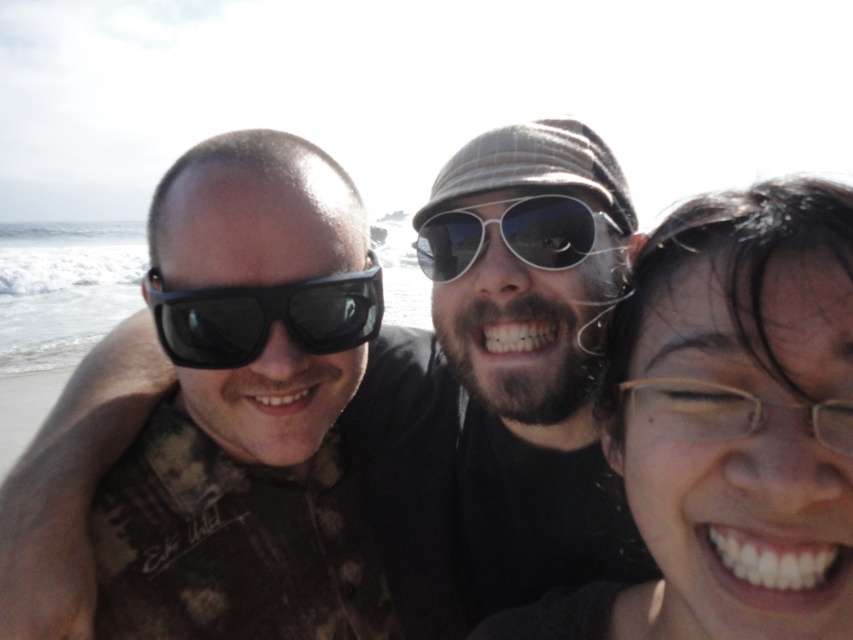
You are a photographer trying to capture a closeup shot of the clear plastic glasses at center and the metal aviator sunglasses at center. Which of these two items has a smaller width?

The clear plastic glasses at center has a lesser width compared to the metal aviator sunglasses at center, so the clear plastic glasses at center is the smaller one in width.

You are standing in front of the three people in the beach photo. You want to throw a ball to the closest point between the two points marked as point 1 at (x=372, y=330) and point 2 at (x=540, y=232). Which point should you aim for to ensure the ball reaches the closer one first?

Point 1 at (x=372, y=330) is closer to the viewer than point 2 at (x=540, y=232), so you should aim for point 1 at (x=372, y=330) to reach the closer one first.